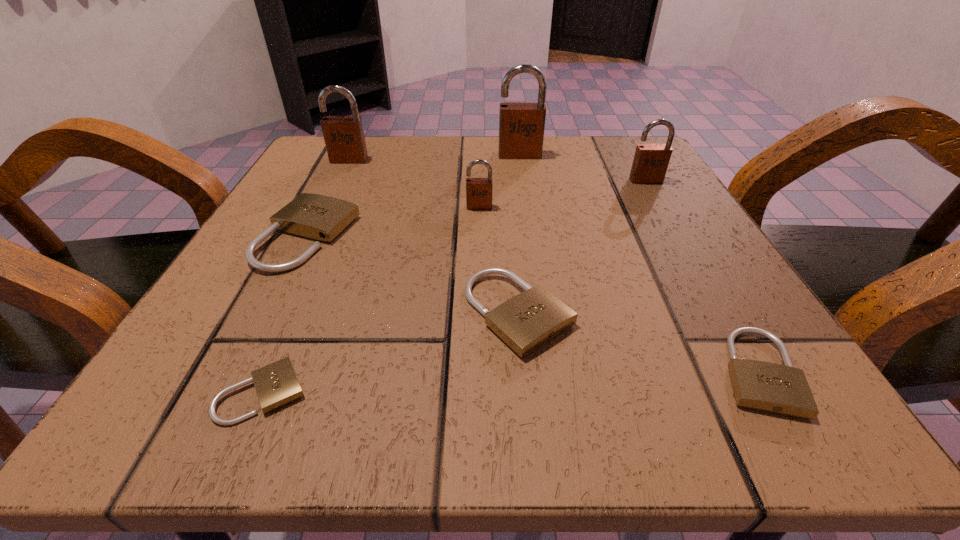
This screenshot has width=960, height=540. I want to click on the third shortest object, so click(526, 322).

Identify the location of the third beige padlock from left to right. (526, 322).

I want to click on the second shortest object, so click(768, 387).

This screenshot has width=960, height=540. Find the location of `the second shortest padlock`. the second shortest padlock is located at coordinates (768, 387).

This screenshot has height=540, width=960. In order to click on the smallest beige padlock in this screenshot , I will do `click(276, 384)`.

Identify the location of the shortest padlock. (276, 384).

What are the coordinates of `vacant point located on the front-facing side of the second brown padlock from right to left` in the screenshot? It's located at (534, 247).

At what (x,y) coordinates should I click in order to perform the action: click on vacant space located on the front-facing side of the second biggest brown padlock. Please return your answer as a coordinate pair (x, y). Image resolution: width=960 pixels, height=540 pixels. Looking at the image, I should click on (306, 247).

Locate an element on the screen. Image resolution: width=960 pixels, height=540 pixels. free region located on the front-facing side of the sixth nearest object is located at coordinates (732, 330).

What are the coordinates of `free space located on the front-facing side of the second brown padlock from left to right` in the screenshot? It's located at (479, 302).